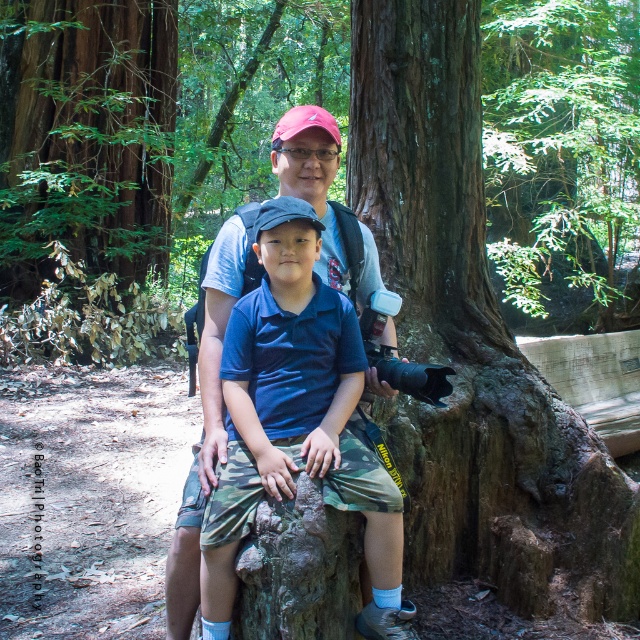
Question: Can you confirm if green leafy tree at upper center is positioned above green rough bark tree at upper left?

Choices:
 (A) no
 (B) yes

Answer: (B)

Question: Can you confirm if brown rough tree trunk at center is positioned above green leafy tree at upper center?

Choices:
 (A) yes
 (B) no

Answer: (B)

Question: Estimate the real-world distances between objects in this image. Which object is closer to the camo shorts at center?

Choices:
 (A) brown rough tree trunk at center
 (B) green leafy tree at upper center
 (C) green rough bark tree at upper left

Answer: (A)

Question: Can you confirm if brown rough tree trunk at center is positioned to the right of camo shorts at center?

Choices:
 (A) yes
 (B) no

Answer: (A)

Question: Which object is positioned farthest from the green leafy tree at upper center?

Choices:
 (A) camo shorts at center
 (B) brown rough tree trunk at center
 (C) green rough bark tree at upper left

Answer: (A)

Question: Which point is closer to the camera taking this photo?

Choices:
 (A) (346, 385)
 (B) (513, 4)

Answer: (A)